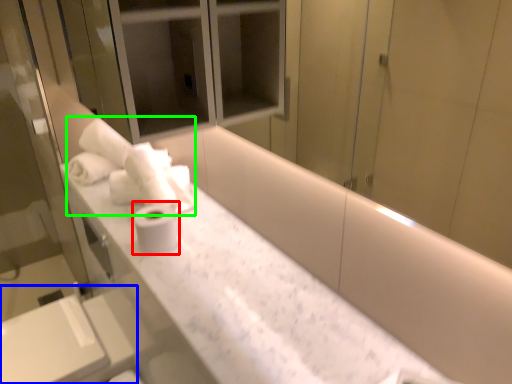
Question: Which object is positioned closest to toilet paper (highlighted by a red box)? Select from sink (highlighted by a blue box) and bath towel (highlighted by a green box).

Choices:
 (A) sink
 (B) bath towel

Answer: (B)